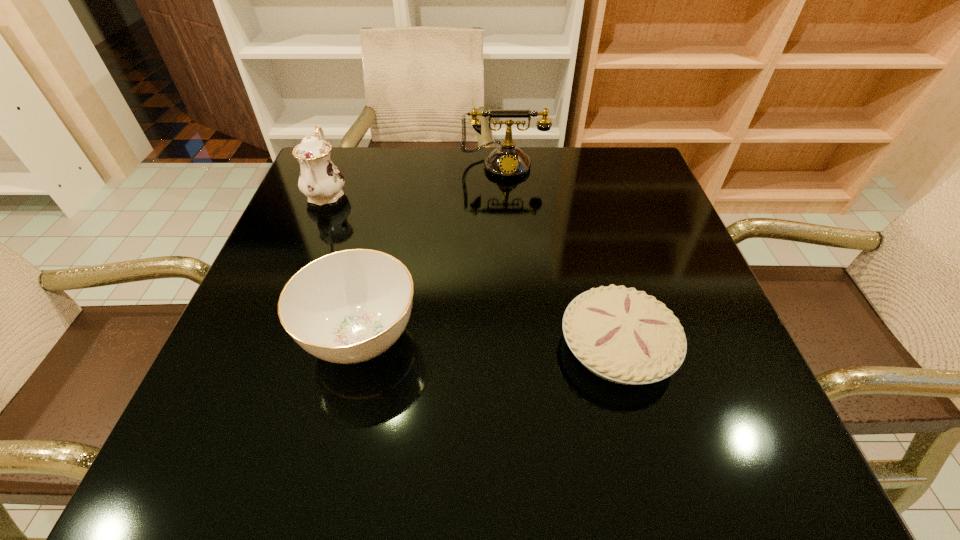
The width and height of the screenshot is (960, 540). I want to click on vacant space that is in between the farther chinaware and the telephone, so click(415, 178).

You are a GUI agent. You are given a task and a screenshot of the screen. Output one action in this format:
    pyautogui.click(x=<x>, y=<y>)
    Task: Click on the free space between the telephone and the farther chinaware
    Image resolution: width=960 pixels, height=540 pixels.
    Given the screenshot: What is the action you would take?
    pyautogui.click(x=415, y=178)

Identify the location of vacant space that's between the shortest object and the telephone. (561, 254).

Identify the location of vacant point located between the pie and the leftmost object. The image size is (960, 540). (472, 269).

Where is `unoccupied area between the telephone and the second shortest object`? unoccupied area between the telephone and the second shortest object is located at coordinates (432, 251).

This screenshot has width=960, height=540. Find the location of `free space between the right chinaware and the telephone`. free space between the right chinaware and the telephone is located at coordinates (432, 251).

At what (x,y) coordinates should I click in order to perform the action: click on blank region between the telephone and the shortest object. Please return your answer as a coordinate pair (x, y). Looking at the image, I should click on (561, 254).

Locate an element on the screen. The width and height of the screenshot is (960, 540). free space between the left chinaware and the pie is located at coordinates 472,269.

Image resolution: width=960 pixels, height=540 pixels. What are the coordinates of `vacant space in between the shorter chinaware and the telephone` in the screenshot? It's located at (432, 251).

Image resolution: width=960 pixels, height=540 pixels. Identify the location of object that is the closest to the taller chinaware. (346, 307).